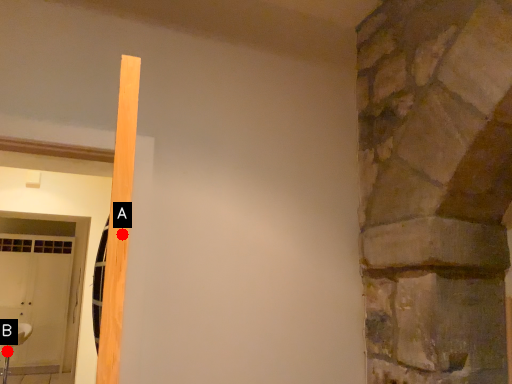
Question: Two points are circled on the image, labeled by A and B beside each circle. Which point is farther to the camera?

Choices:
 (A) A is further
 (B) B is further

Answer: (B)